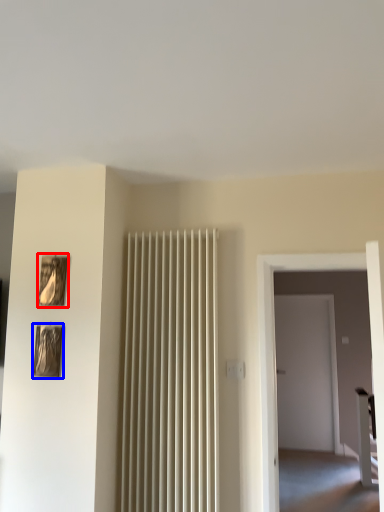
Question: Which object appears closest to the camera in this image, picture frame (highlighted by a red box) or picture frame (highlighted by a blue box)?

Choices:
 (A) picture frame
 (B) picture frame

Answer: (B)